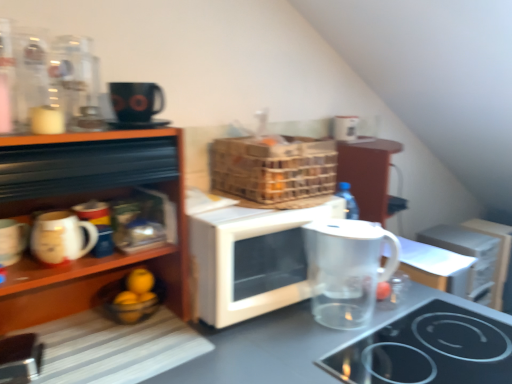
Identify the location of wooden shelves at left. (87, 200).

Measure the distance between transparent plastic pitcher at lower right and camera.

The depth of transparent plastic pitcher at lower right is 1.37 meters.

The height and width of the screenshot is (384, 512). Find the location of `white matte microwave at center`. white matte microwave at center is located at coordinates pyautogui.click(x=250, y=260).

What is the approximate width of white matte microwave at center?

The width of white matte microwave at center is 15.32 inches.

The width and height of the screenshot is (512, 384). Describe the element at coordinates (61, 237) in the screenshot. I see `white glossy mug at lower left, acting as the first mug starting from the right` at that location.

This screenshot has width=512, height=384. I want to click on transparent glass pitcher at center, so (263, 351).

From the picture: How different are the orientations of wooden shelves at left and white glossy mug at lower left, acting as the first mug starting from the right, in degrees?

wooden shelves at left and white glossy mug at lower left, acting as the first mug starting from the right, are facing 1.82 degrees away from each other.

Is wooden shelves at left looking in the opposite direction of white glossy mug at lower left, acting as the first mug starting from the right?

Absolutely, wooden shelves at left is directed away from white glossy mug at lower left, acting as the first mug starting from the right.

Can we say wooden shelves at left lies outside white glossy mug at lower left, which is the second mug in left-to-right order?

Yes, wooden shelves at left is outside of white glossy mug at lower left, which is the second mug in left-to-right order.

Is black glass cooktop at lower right oriented away from transparent plastic pitcher at lower right?

That's not correct — black glass cooktop at lower right is not looking away from transparent plastic pitcher at lower right.

How many degrees apart are the facing directions of black glass cooktop at lower right and transparent plastic pitcher at lower right?

90 degrees.

Which object is thinner, black glass cooktop at lower right or transparent plastic pitcher at lower right?

transparent plastic pitcher at lower right.

Who is shorter, black glass cooktop at lower right or transparent plastic pitcher at lower right?

black glass cooktop at lower right is shorter.

In the scene shown: From a real-world perspective, does transparent plastic pitcher at lower right stand above transparent glass jug at lower right?

No, from a real-world perspective, transparent plastic pitcher at lower right is not on top of transparent glass jug at lower right.

Which object is positioned more to the right, transparent plastic pitcher at lower right or transparent glass jug at lower right?

From the viewer's perspective, transparent plastic pitcher at lower right appears more on the right side.

Does point (421, 250) lie in front of point (371, 289)?

No.

From a real-world perspective, is white matte microwave at center located beneath transparent glass pitcher at center?

No, from a real-world perspective, white matte microwave at center is not under transparent glass pitcher at center.

Could you tell me if white matte microwave at center is facing transparent glass pitcher at center?

No, white matte microwave at center is not oriented towards transparent glass pitcher at center.

Is white matte microwave at center behind transparent glass pitcher at center?

That is True.

Considering the sizes of white matte microwave at center and transparent glass pitcher at center in the image, is white matte microwave at center bigger or smaller than transparent glass pitcher at center?

Considering their sizes, white matte microwave at center takes up less space than transparent glass pitcher at center.

Between black glass cooktop at lower right and wooden shelves at left, which one is positioned behind?

wooden shelves at left is more distant.

From the image's perspective, is black glass cooktop at lower right above wooden shelves at left?

No, from the image's perspective, black glass cooktop at lower right is not above wooden shelves at left.

Can you confirm if black glass cooktop at lower right is bigger than wooden shelves at left?

No, black glass cooktop at lower right is not bigger than wooden shelves at left.

In the scene shown: Is black glass cooktop at lower right at the left side of wooden shelves at left?

No.

Locate an element on the screen. the 1st mug counting from the left of the black glass cooktop at lower right is located at coordinates (61, 237).

Does black glass cooktop at lower right have a larger size compared to white glossy mug at lower left, which is the second mug in left-to-right order?

Indeed, black glass cooktop at lower right has a larger size compared to white glossy mug at lower left, which is the second mug in left-to-right order.

Can you confirm if black glass cooktop at lower right is taller than white glossy mug at lower left, acting as the first mug starting from the right?

In fact, black glass cooktop at lower right may be shorter than white glossy mug at lower left, acting as the first mug starting from the right.

Is black glass cooktop at lower right turned away from transparent glass pitcher at center?

Yes, black glass cooktop at lower right is positioned with its back facing transparent glass pitcher at center.

What's the angular difference between black glass cooktop at lower right and transparent glass pitcher at center's facing directions?

The angle between the facing direction of black glass cooktop at lower right and the facing direction of transparent glass pitcher at center is 0.61 degrees.

Between black glass cooktop at lower right and transparent glass pitcher at center, which one has smaller width?

black glass cooktop at lower right.

From the image's perspective, is black glass cooktop at lower right over transparent glass pitcher at center?

Correct, black glass cooktop at lower right appears higher than transparent glass pitcher at center in the image.

In order to click on cabinetry that appears in front of the white glossy mug at lower left, which is the second mug in left-to-right order in this screenshot , I will do `click(87, 200)`.

Locate an element on the screen. gas stove below the transparent plastic pitcher at lower right (from the image's perspective) is located at coordinates (428, 349).

Estimate the real-world distances between objects in this image. Which object is further from wooden shelves at left, matte white mug at left, which appears as the 1th mug when viewed from the left, or white matte microwave at center?

The object further to wooden shelves at left is matte white mug at left, which appears as the 1th mug when viewed from the left.

When comparing their distances from transparent glass pitcher at center, does white matte microwave at center or black glass cooktop at lower right seem further?

The object further to transparent glass pitcher at center is black glass cooktop at lower right.

Which object lies further to the anchor point transparent glass pitcher at center, white glossy mug at lower left, which is the second mug in left-to-right order, or black glass cooktop at lower right?

white glossy mug at lower left, which is the second mug in left-to-right order, is positioned further to the anchor transparent glass pitcher at center.

Estimate the real-world distances between objects in this image. Which object is further from transparent glass pitcher at center, transparent plastic pitcher at lower right or black glass cooktop at lower right?

Based on the image, transparent plastic pitcher at lower right appears to be further to transparent glass pitcher at center.

From the image, which object appears to be nearer to wooden shelves at left, transparent glass jug at lower right or white glossy mug at lower left, which is the second mug in left-to-right order?

white glossy mug at lower left, which is the second mug in left-to-right order.

Based on their spatial positions, is transparent glass pitcher at center or matte white mug at left, which appears as the 1th mug when viewed from the left, further from transparent glass jug at lower right?

matte white mug at left, which appears as the 1th mug when viewed from the left.

When comparing their distances from white glossy mug at lower left, which is the second mug in left-to-right order, does wooden shelves at left or white matte microwave at center seem closer?

wooden shelves at left is closer to white glossy mug at lower left, which is the second mug in left-to-right order.

When comparing their distances from matte white mug at left, marked as the second mug in a right-to-left arrangement, does wooden shelves at left or transparent plastic pitcher at lower right seem closer?

Based on the image, wooden shelves at left appears to be nearer to matte white mug at left, marked as the second mug in a right-to-left arrangement.

Where is `cabinetry between matte white mug at left, marked as the second mug in a right-to-left arrangement, and black glass cooktop at lower right`? This screenshot has height=384, width=512. cabinetry between matte white mug at left, marked as the second mug in a right-to-left arrangement, and black glass cooktop at lower right is located at coordinates (87, 200).

Image resolution: width=512 pixels, height=384 pixels. I want to click on jug between white matte microwave at center and transparent plastic pitcher at lower right in the horizontal direction, so click(346, 269).

Locate an element on the screen. cabinetry between matte white mug at left, marked as the second mug in a right-to-left arrangement, and transparent plastic pitcher at lower right from left to right is located at coordinates (87, 200).

The image size is (512, 384). What are the coordinates of `jug between white glossy mug at lower left, which is the second mug in left-to-right order, and transparent plastic pitcher at lower right` in the screenshot? It's located at (346, 269).